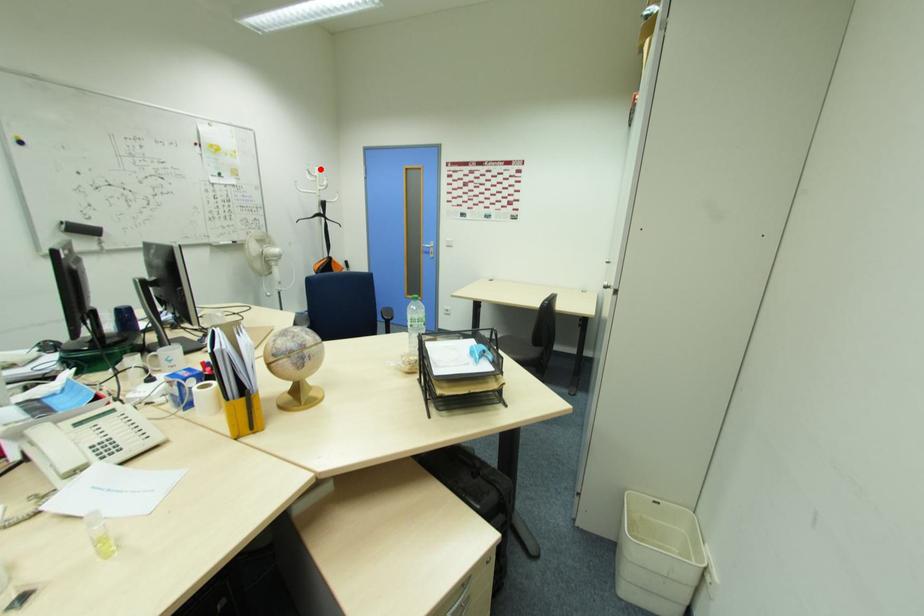
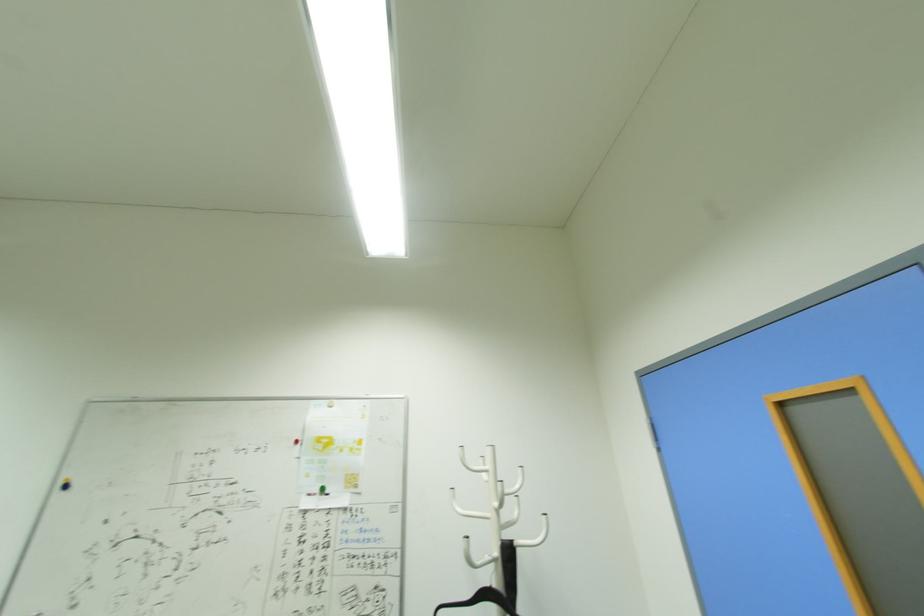
Question: I am providing you with two images of the same scene from different viewpoints. Given a red point in image1, look at the same physical point in image2. Is it:

Choices:
 (A) Closer to the viewpoint
 (B) Farther from the viewpoint

Answer: (B)